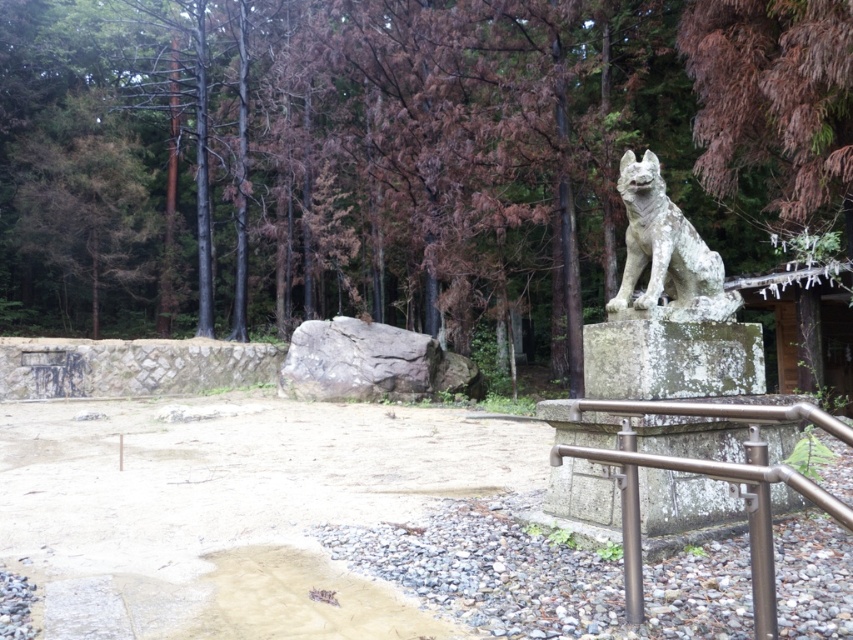
Between green textured rock at center and white stone statue at upper right, which one appears on the right side from the viewer's perspective?

From the viewer's perspective, white stone statue at upper right appears more on the right side.

Between green textured rock at center and white stone statue at upper right, which one has more height?

With more height is green textured rock at center.

Describe the element at coordinates (398, 156) in the screenshot. I see `green textured rock at center` at that location.

Identify the location of green textured rock at center. (398, 156).

Between green textured rock at center and satin silver railing at lower right, which one appears on the left side from the viewer's perspective?

green textured rock at center is more to the left.

The height and width of the screenshot is (640, 853). Describe the element at coordinates (398, 156) in the screenshot. I see `green textured rock at center` at that location.

Identify the location of green textured rock at center. Image resolution: width=853 pixels, height=640 pixels. click(398, 156).

Can you confirm if satin silver railing at lower right is positioned below white stone statue at upper right?

Correct, satin silver railing at lower right is located below white stone statue at upper right.

Is satin silver railing at lower right shorter than white stone statue at upper right?

Correct, satin silver railing at lower right is not as tall as white stone statue at upper right.

Who is more forward, (625, 449) or (665, 189)?

Point (625, 449)

The image size is (853, 640). In order to click on satin silver railing at lower right in this screenshot , I will do `click(712, 477)`.